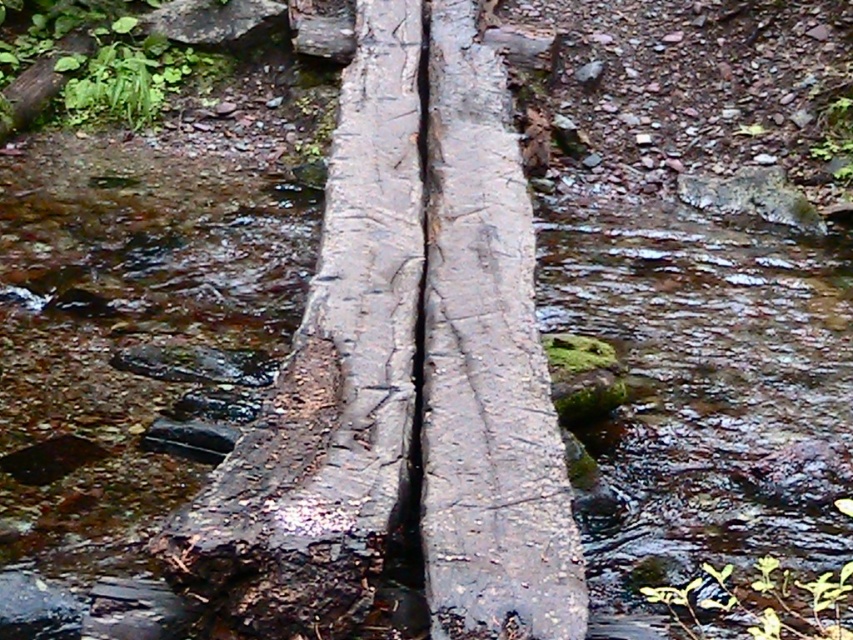
You are standing at the edge of the stream and see the wet wood log at center. Can you determine if the log is positioned closer to the left or right side of the stream?

The wet wood log at center is located at point (x=131, y=371), which places it closer to the right side of the stream.

You are hiking and come across a stream with a bridge made of two logs. You need to cross to the other side. The bridge has a wet wood log at center and a rough bark log at center. Which log should you step on first if you want to start from the left side?

The wet wood log at center is positioned on the left side of rough bark log at center, so you should step on the wet wood log at center first.